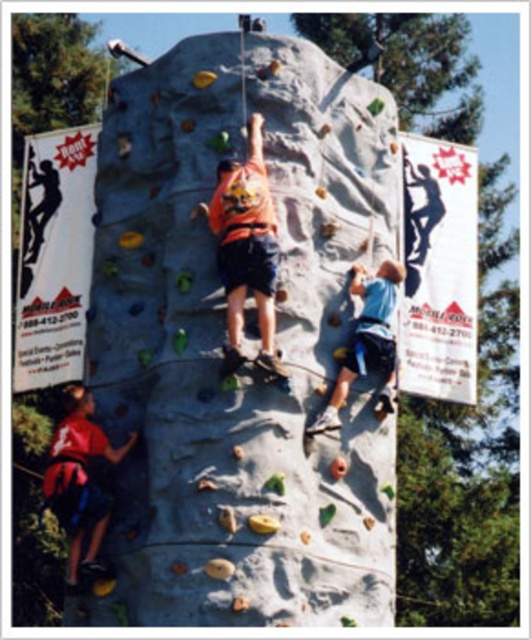
Can you confirm if smooth gray rock climbing wall at center is shorter than blue fabric climbing harness at lower right?

No, smooth gray rock climbing wall at center is not shorter than blue fabric climbing harness at lower right.

Is point (245, 422) positioned before point (356, 348)?

That is True.

You are a GUI agent. You are given a task and a screenshot of the screen. Output one action in this format:
    pyautogui.click(x=<x>, y=<y>)
    Task: Click on the smooth gray rock climbing wall at center
    The width and height of the screenshot is (531, 640).
    Given the screenshot: What is the action you would take?
    pyautogui.click(x=222, y=342)

Based on the photo, who is positioned more to the right, smooth gray rock climbing wall at center or matte red shirt at lower left?

From the viewer's perspective, smooth gray rock climbing wall at center appears more on the right side.

Who is positioned more to the left, smooth gray rock climbing wall at center or matte red shirt at lower left?

From the viewer's perspective, matte red shirt at lower left appears more on the left side.

Between point (241, 392) and point (80, 529), which one is positioned behind?

Point (80, 529)

This screenshot has width=531, height=640. What are the coordinates of `smooth gray rock climbing wall at center` in the screenshot? It's located at pos(222,342).

Locate an element on the screen. The width and height of the screenshot is (531, 640). orange fabric shirt at center is located at coordinates (246, 248).

Is orange fabric shirt at center wider than blue fabric climbing harness at lower right?

Indeed, orange fabric shirt at center has a greater width compared to blue fabric climbing harness at lower right.

What do you see at coordinates (246, 248) in the screenshot? This screenshot has height=640, width=531. I see `orange fabric shirt at center` at bounding box center [246, 248].

Find the location of `orange fabric shirt at center`. orange fabric shirt at center is located at coordinates pyautogui.click(x=246, y=248).